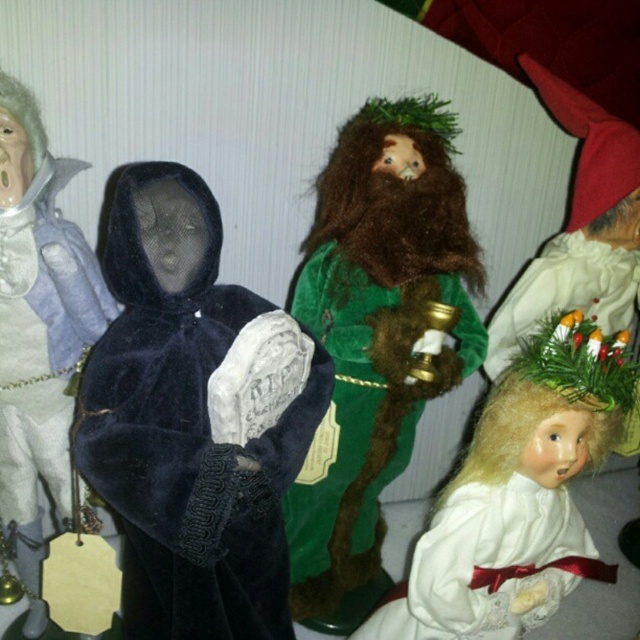
Which of these two, velvet black cape at center or white matte doll at lower right, stands taller?

With more height is velvet black cape at center.

The image size is (640, 640). What do you see at coordinates (184, 422) in the screenshot?
I see `velvet black cape at center` at bounding box center [184, 422].

Locate an element on the screen. velvet black cape at center is located at coordinates (184, 422).

Can you confirm if white matte doll at lower right is positioned below velvet black cloak at left?

Yes.

Does white matte doll at lower right appear on the left side of velvet black cloak at left?

No, white matte doll at lower right is not to the left of velvet black cloak at left.

Is point (532, 493) positioned in front of point (67, 330)?

No, it is not.

At what (x,y) coordinates should I click in order to perform the action: click on white matte doll at lower right. Please return your answer as a coordinate pair (x, y). The height and width of the screenshot is (640, 640). Looking at the image, I should click on tap(516, 493).

This screenshot has height=640, width=640. What do you see at coordinates (376, 339) in the screenshot?
I see `green velvet figure at center` at bounding box center [376, 339].

Is green velvet figure at center taller than white matte doll at lower right?

Correct, green velvet figure at center is much taller as white matte doll at lower right.

Find the location of a particular element. green velvet figure at center is located at coordinates (376, 339).